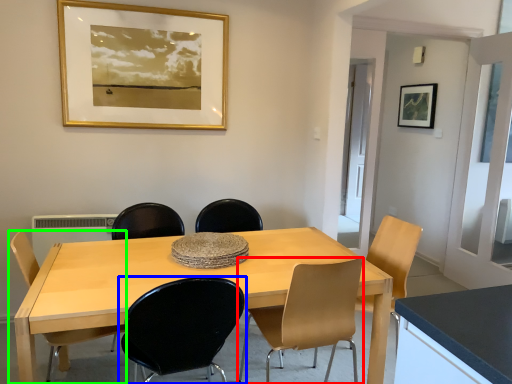
Question: Based on their relative distances, which object is nearer to chair (highlighted by a red box)? Choose from chair (highlighted by a blue box) and chair (highlighted by a green box).

Choices:
 (A) chair
 (B) chair

Answer: (A)